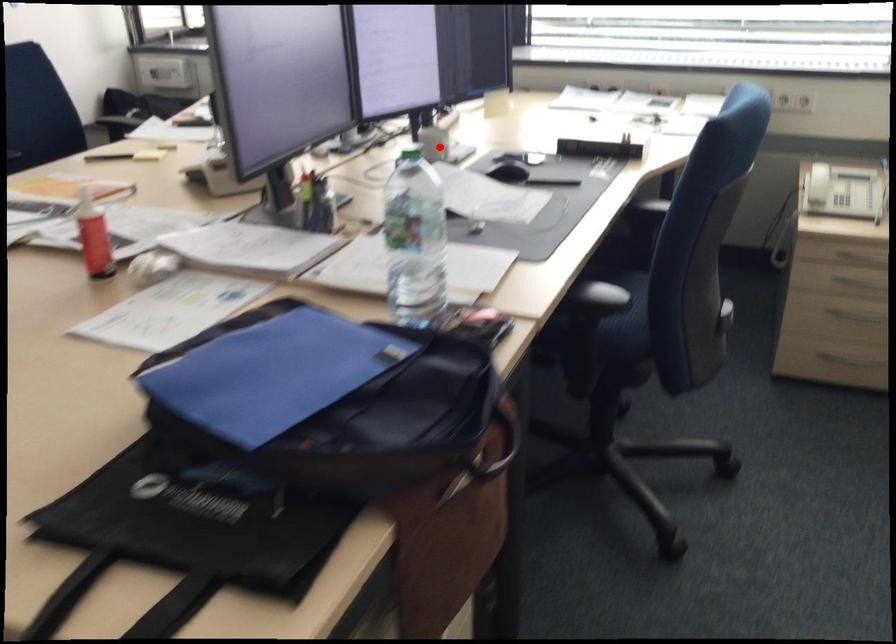
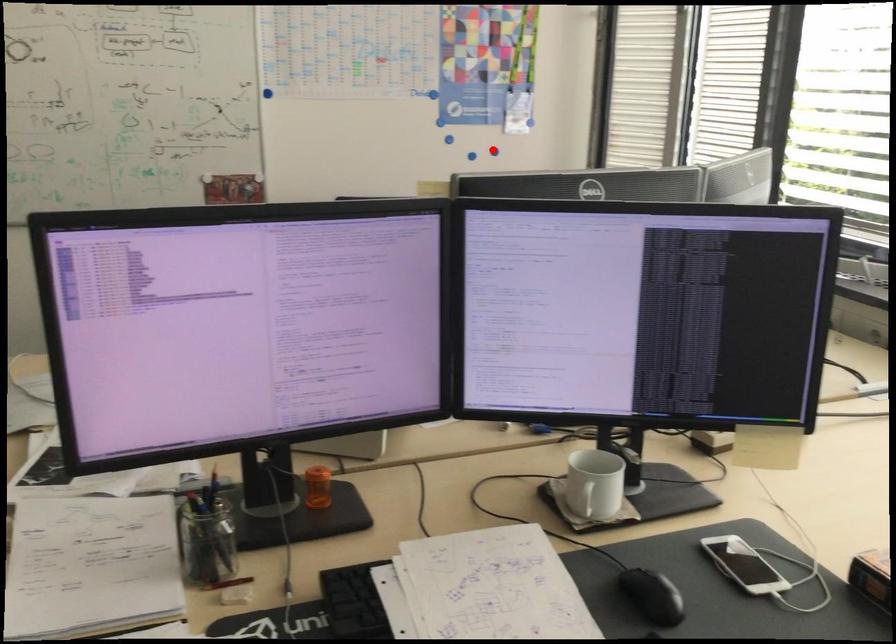
I am providing you with two images of the same scene from different viewpoints. A red point is marked on the first image and another point is marked on the second image. Is the red point in image1 aligned with the point shown in image2?

No